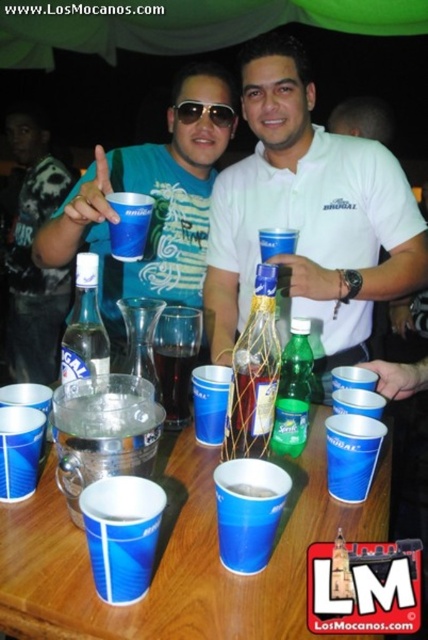
Question: Which object is the closest to the clear glass bottle at center?

Choices:
 (A) matte black shirt at center
 (B) sunglasses at center
 (C) dark brown liquid at center
 (D) brushed metal cup at upper center

Answer: (C)

Question: Which object appears farthest from the camera in this image?

Choices:
 (A) dark brown liquid at center
 (B) blue paper cups at center

Answer: (A)

Question: Which of the following is the farthest from the observer?

Choices:
 (A) white matte shirt at center
 (B) green glass bottle at center

Answer: (A)

Question: Is brushed metal cup at upper center thinner than clear glass bottle at center?

Choices:
 (A) yes
 (B) no

Answer: (B)

Question: Is white matte shirt at center below brushed metal cup at upper center?

Choices:
 (A) yes
 (B) no

Answer: (A)

Question: Where is brushed metal cup at upper center located in relation to dark brown liquid at center in the image?

Choices:
 (A) above
 (B) below

Answer: (A)